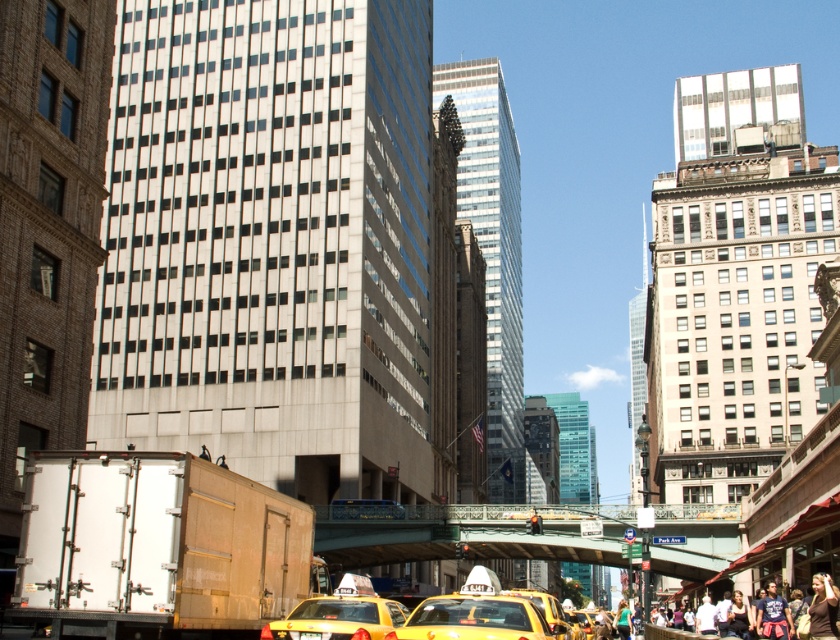
You are a pedestrian standing on the sidewalk and see both the yellow matte taxi at lower center and the brown leather jacket at lower right. Which object is closer to the left side of the street?

The yellow matte taxi at lower center is positioned on the left side of the brown leather jacket at lower right, so it is closer to the left side of the street.